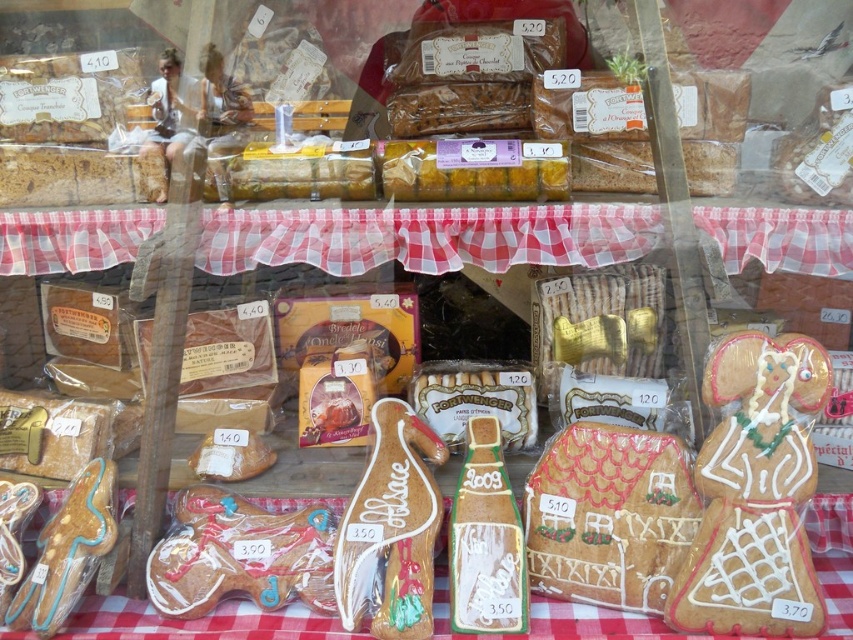
Question: Does white frosted gingerbread house at center have a greater width compared to matte brown gingerbread man at lower left?

Choices:
 (A) yes
 (B) no

Answer: (B)

Question: Is white frosted gingerbread house at center positioned in front of matte brown gingerbread man at lower left?

Choices:
 (A) no
 (B) yes

Answer: (B)

Question: Does white frosted gingerbread house at center come behind matte brown gingerbread man at lower left?

Choices:
 (A) yes
 (B) no

Answer: (B)

Question: Which object is farther from the camera taking this photo?

Choices:
 (A) white frosted gingerbread house at center
 (B) matte brown gingerbread man at lower left

Answer: (B)

Question: Which point is closer to the camera taking this photo?

Choices:
 (A) (671, 522)
 (B) (209, 538)

Answer: (A)